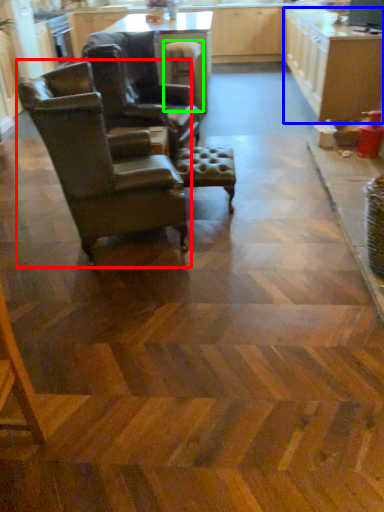
Question: Considering the real-world distances, which object is closest to chair (highlighted by a red box)? cabinetry (highlighted by a blue box) or bar stool (highlighted by a green box).

Choices:
 (A) cabinetry
 (B) bar stool

Answer: (B)